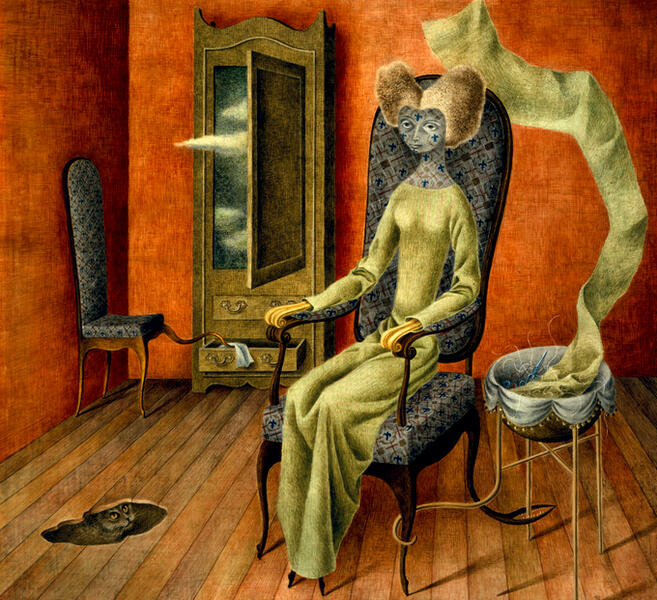
Where is `bowl`? The image size is (657, 600). bowl is located at coordinates click(539, 432).